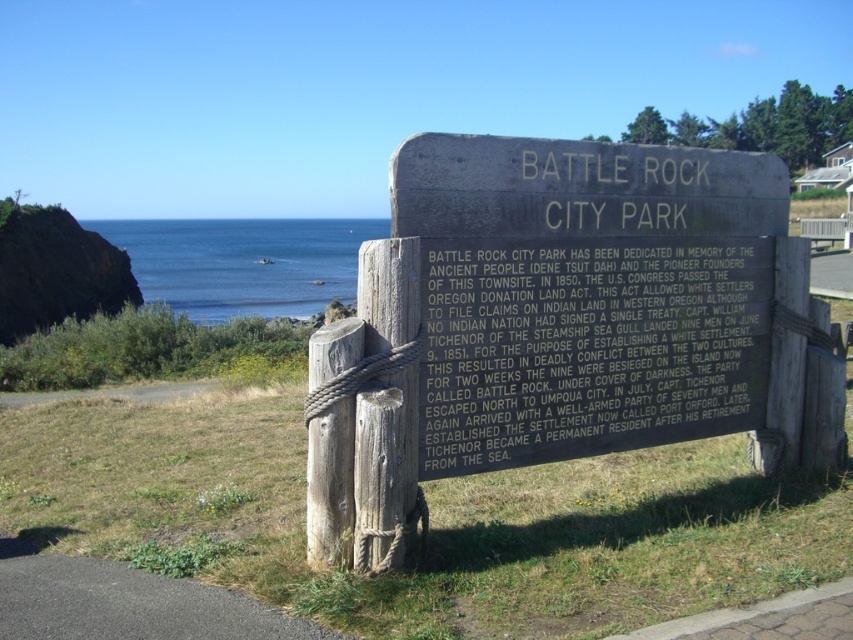
Is point (322, 225) farther from viewer compared to point (364, 243)?

Yes.

Can you confirm if blue water at center is thinner than rope-tied wood post at center?

Incorrect, blue water at center's width is not less than rope-tied wood post at center's.

Between point (334, 260) and point (412, 276), which one is positioned in front?

Point (412, 276)

The width and height of the screenshot is (853, 640). I want to click on blue water at center, so click(242, 262).

In the scene shown: Can you confirm if black polished stone plaque at center is taller than blue water at center?

No.

Between point (421, 456) and point (219, 288), which one is positioned behind?

The point (219, 288) is more distant.

Is point (730, 305) closer to viewer compared to point (229, 276)?

Yes, it is in front of point (229, 276).

Locate an element on the screen. The height and width of the screenshot is (640, 853). black polished stone plaque at center is located at coordinates (587, 348).

Which of these two, black polished stone plaque at center or rope-tied wood post at center, stands taller?

With more height is rope-tied wood post at center.

Who is more distant from viewer, (627, 408) or (412, 506)?

The point (627, 408) is more distant.

Find the location of a particular element. This screenshot has height=640, width=853. black polished stone plaque at center is located at coordinates (587, 348).

Find the location of a particular element. This screenshot has width=853, height=640. black polished stone plaque at center is located at coordinates (587, 348).